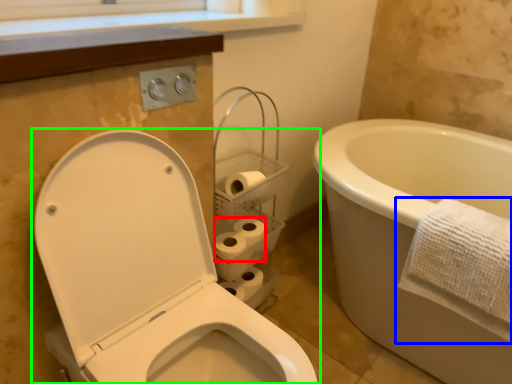
Question: Based on their relative distances, which object is farther from toilet paper (highlighted by a red box)? Choose from towel (highlighted by a blue box) and toilet (highlighted by a green box).

Choices:
 (A) towel
 (B) toilet

Answer: (A)